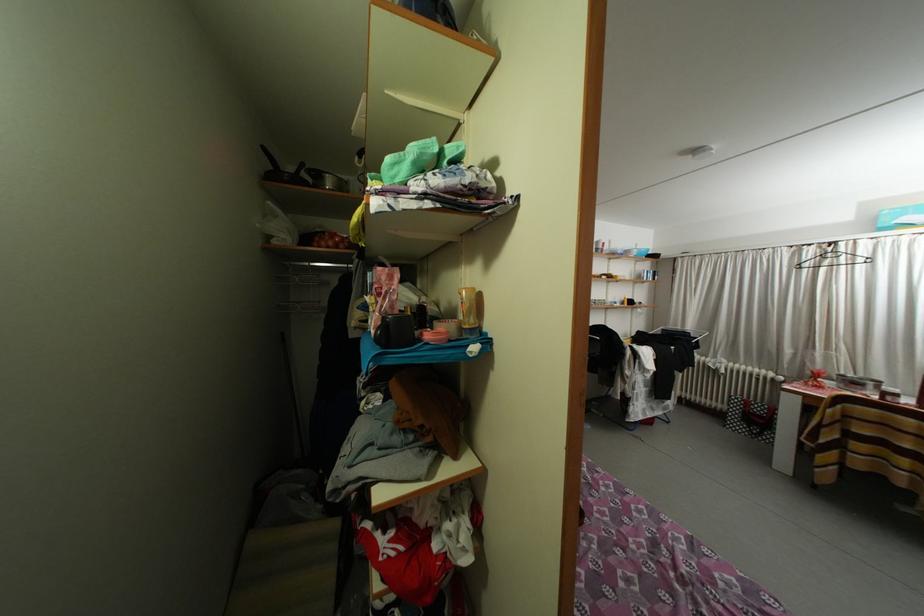
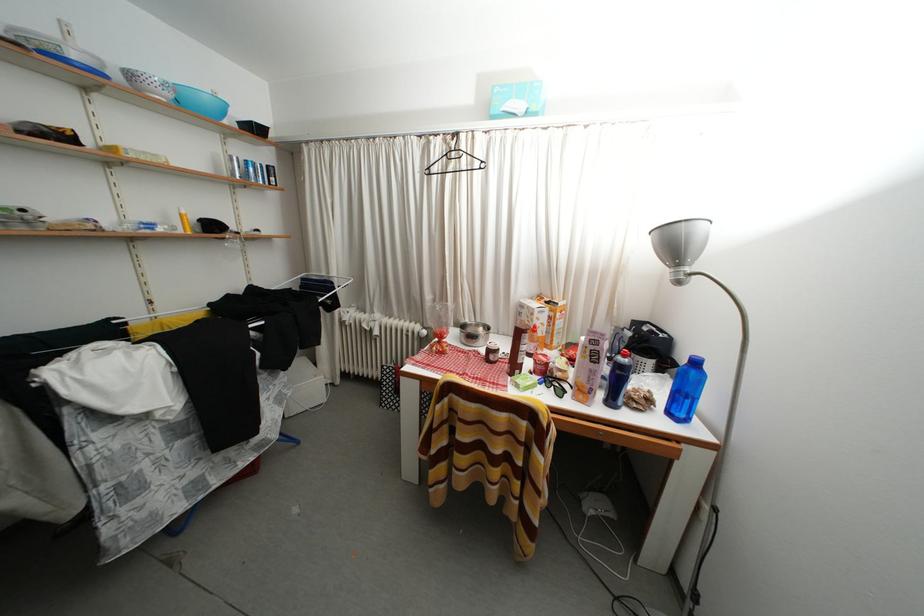
Locate, in the second image, the point that corresponds to the point at 833,268 in the first image.

(458, 172)